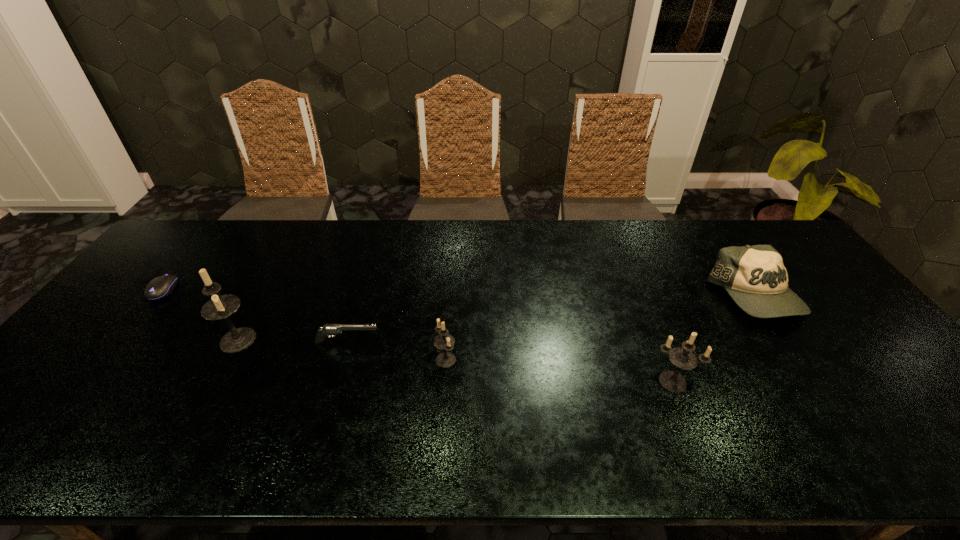
The width and height of the screenshot is (960, 540). What are the coordinates of `the third shortest object` in the screenshot? It's located at (755, 278).

Locate an element on the screen. The width and height of the screenshot is (960, 540). the rightmost object is located at coordinates (755, 278).

Identify the location of vacant space situated 0.110m on the back of the fifth object from right to left. The height and width of the screenshot is (540, 960). [262, 295].

At what (x,y) coordinates should I click in order to perform the action: click on vacant space located 0.170m on the right of the second candle holder from right to left. Please return your answer as a coordinate pair (x, y). The image size is (960, 540). Looking at the image, I should click on (522, 360).

You are a GUI agent. You are given a task and a screenshot of the screen. Output one action in this format:
    pyautogui.click(x=<x>, y=<y>)
    Task: Click on the vacant position located on the right of the fifth object from left to right
    This screenshot has width=960, height=540.
    Given the screenshot: What is the action you would take?
    pyautogui.click(x=817, y=381)

The width and height of the screenshot is (960, 540). I want to click on vacant space positioned on the front of the leftmost object, so click(69, 408).

Locate an element on the screen. free region located 0.400m on the front-facing side of the second shortest object is located at coordinates (530, 342).

At what (x,y) coordinates should I click in order to perform the action: click on free space located 0.200m on the front-facing side of the rightmost object. Please return your answer as a coordinate pair (x, y). This screenshot has width=960, height=540. Looking at the image, I should click on (817, 389).

Image resolution: width=960 pixels, height=540 pixels. Identify the location of object at the near edge. (682, 357).

I want to click on object present at the left edge, so click(x=160, y=287).